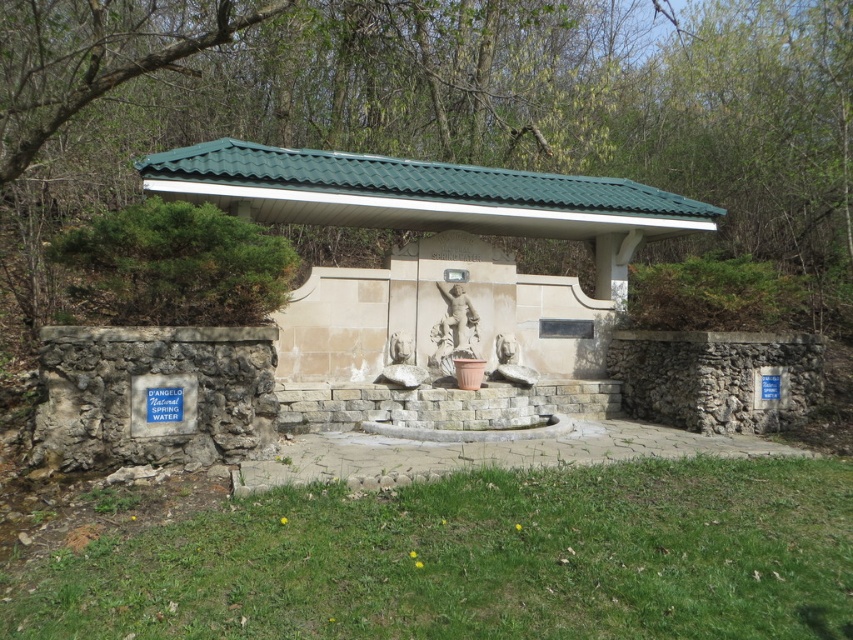
Question: Is green leafy tree at upper center bigger than white stone fountain at center?

Choices:
 (A) yes
 (B) no

Answer: (A)

Question: Which point is closer to the camera?

Choices:
 (A) green leafy tree at upper center
 (B) white stone fountain at center

Answer: (A)

Question: Which point appears farthest from the camera in this image?

Choices:
 (A) (326, 276)
 (B) (119, 144)

Answer: (B)

Question: Does green leafy tree at upper center appear on the left side of white stone fountain at center?

Choices:
 (A) no
 (B) yes

Answer: (A)

Question: Is green leafy tree at upper center below white stone fountain at center?

Choices:
 (A) yes
 (B) no

Answer: (B)